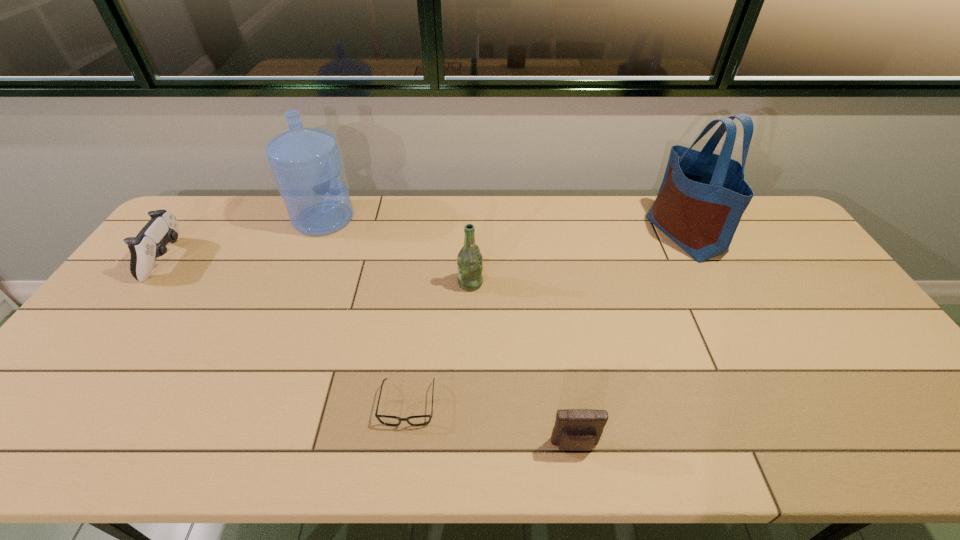
Find the location of `free point between the leftmost object and the handbag`. free point between the leftmost object and the handbag is located at coordinates (426, 247).

Locate an element on the screen. The height and width of the screenshot is (540, 960). vacant region between the third object from left to right and the leftmost object is located at coordinates (288, 332).

Where is `free space between the fifth object from left to right and the spectacles`? free space between the fifth object from left to right and the spectacles is located at coordinates (492, 425).

This screenshot has height=540, width=960. Identify the location of unoccupied area between the shortest object and the leftmost object. (288, 332).

Where is `blank region between the handbag and the third object from right to left`? The height and width of the screenshot is (540, 960). blank region between the handbag and the third object from right to left is located at coordinates (578, 259).

Find the location of `blank region between the beer bottle and the shortest object`. blank region between the beer bottle and the shortest object is located at coordinates (440, 343).

You are a GUI agent. You are given a task and a screenshot of the screen. Output one action in this format:
    pyautogui.click(x=<x>, y=<y>)
    Task: Click on the empty location between the fifth object from right to left and the leftmost object
    The image size is (960, 540).
    Given the screenshot: What is the action you would take?
    pyautogui.click(x=246, y=239)

Locate which object is the second closest to the fourth shortest object. Please provide its 2D coordinates. Your answer should be formatted as a tuple, i.e. [(x, y)], where the tuple contains the x and y coordinates of a point satisfying the conditions above.

[(306, 162)]

Identify which object is located as the fourth nearest to the spectacles. Please provide its 2D coordinates. Your answer should be formatted as a tuple, i.e. [(x, y)], where the tuple contains the x and y coordinates of a point satisfying the conditions above.

[(150, 243)]

The width and height of the screenshot is (960, 540). Identify the location of vacant space that satisfies the following two spatial constraints: 1. on the side of the fifth object from right to left with the handle; 2. on the right side of the handbag. (317, 234).